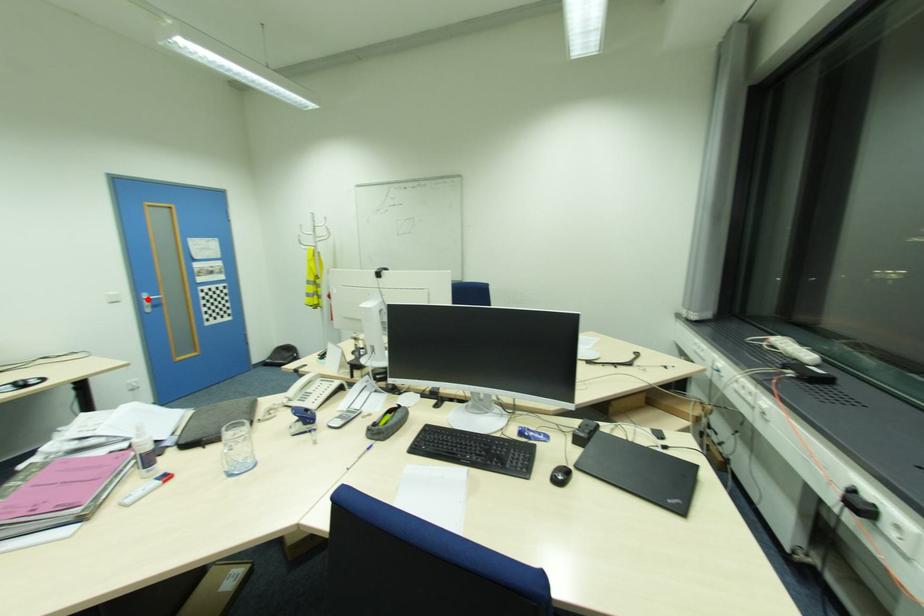
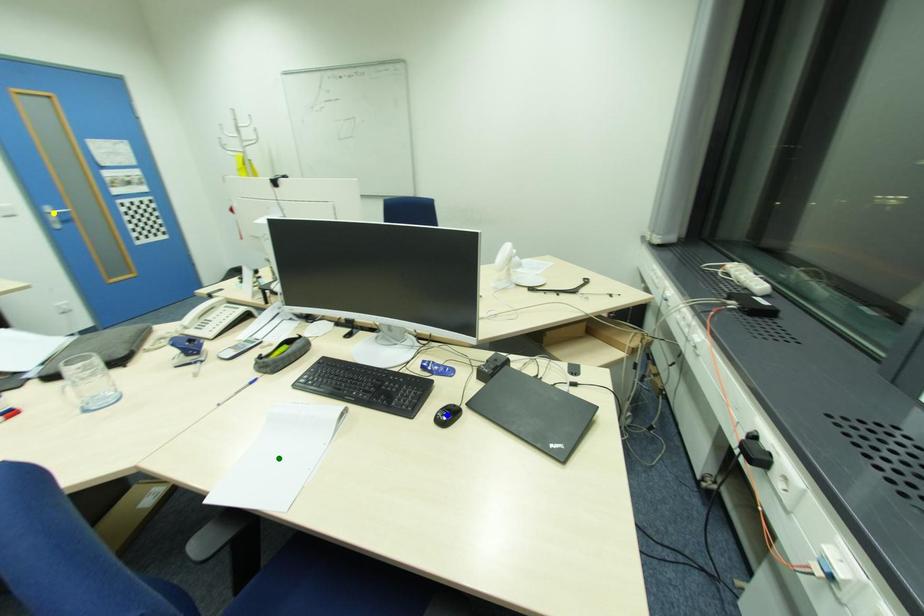
Question: I am providing you with two images of the same scene from different viewpoints. A red point is marked on the first image. You are given multiple points on the second image. In image 2, which mark is for the same physical point as the one in image 1?

Choices:
 (A) blue point
 (B) yellow point
 (C) green point

Answer: (B)